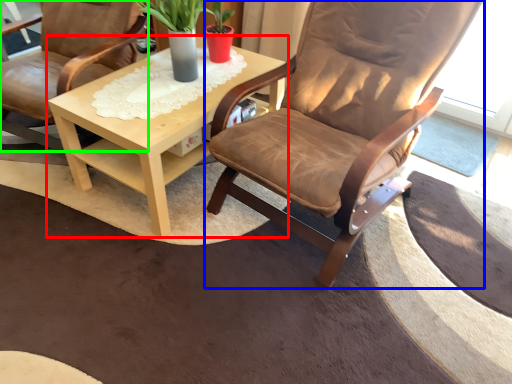
Question: Considering the real-world distances, which object is farthest from coffee table (highlighted by a red box)? chair (highlighted by a blue box) or chair (highlighted by a green box)?

Choices:
 (A) chair
 (B) chair

Answer: (A)